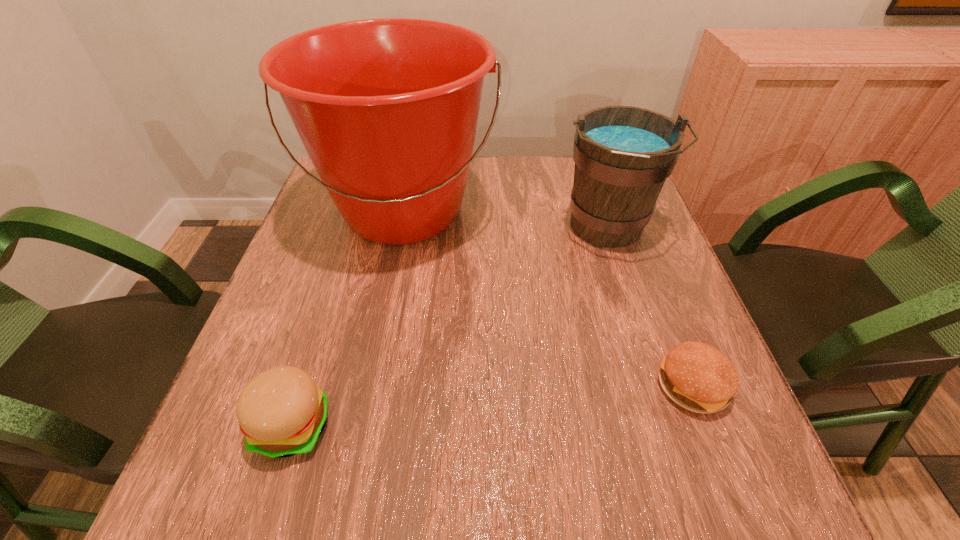
Image resolution: width=960 pixels, height=540 pixels. I want to click on free space between the second shortest object and the wine bucket, so click(450, 327).

Where is `free space that is in between the bucket and the shortest object`? The height and width of the screenshot is (540, 960). free space that is in between the bucket and the shortest object is located at coordinates (548, 299).

Where is `free space between the bucket and the right hamburger`? This screenshot has width=960, height=540. free space between the bucket and the right hamburger is located at coordinates (548, 299).

At what (x,y) coordinates should I click in order to perform the action: click on the second closest object to the wine bucket. Please return your answer as a coordinate pair (x, y). Looking at the image, I should click on (696, 376).

You are a GUI agent. You are given a task and a screenshot of the screen. Output one action in this format:
    pyautogui.click(x=<x>, y=<y>)
    Task: Click on the object identified as the third closest to the third tallest object
    
    Given the screenshot: What is the action you would take?
    pyautogui.click(x=696, y=376)

This screenshot has height=540, width=960. What are the coordinates of `free space that satisfies the following two spatial constraints: 1. with the handle attached to the rim of the shortest object; 2. on the left side of the bucket` in the screenshot? It's located at (368, 387).

Image resolution: width=960 pixels, height=540 pixels. Identify the location of free point that satisfies the following two spatial constraints: 1. with the handle attached to the rim of the tallest object; 2. on the right side of the shorter hamburger. (368, 387).